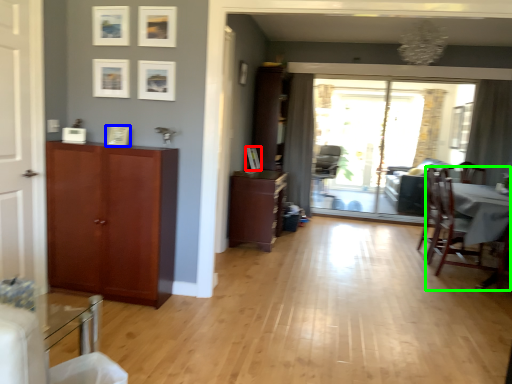
Question: Considering the real-world distances, which object is closest to picture frame (highlighted by a red box)? picture frame (highlighted by a blue box) or chair (highlighted by a green box).

Choices:
 (A) picture frame
 (B) chair

Answer: (A)